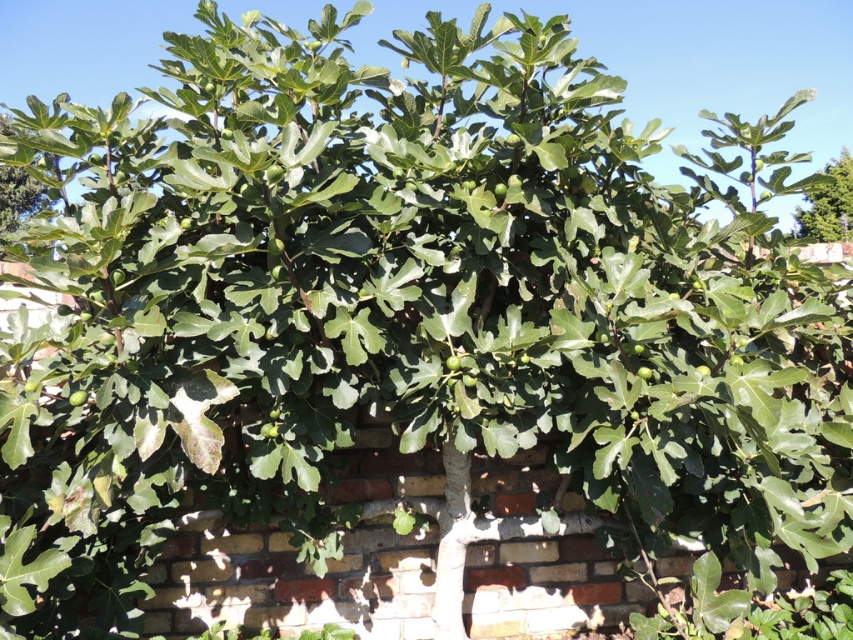
Can you confirm if green leafy fig tree at upper right is bigger than green matte fig tree at upper left?

No, green leafy fig tree at upper right is not bigger than green matte fig tree at upper left.

Which is behind, point (824, 188) or point (33, 179)?

The point (33, 179) is behind.

Identify the location of green leafy fig tree at upper right. (828, 205).